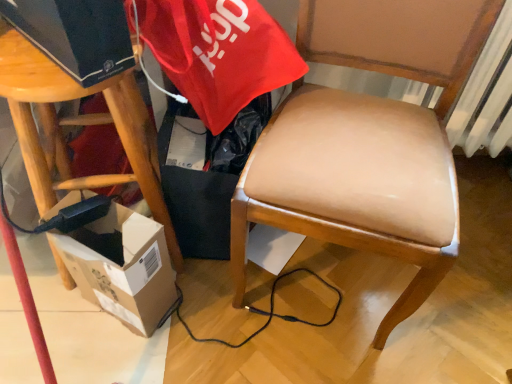
Question: Is wooden stool at left located outside cardboard box at lower left?

Choices:
 (A) yes
 (B) no

Answer: (A)

Question: Is the surface of wooden stool at left in direct contact with cardboard box at lower left?

Choices:
 (A) yes
 (B) no

Answer: (B)

Question: From the image's perspective, is wooden stool at left located above cardboard box at lower left?

Choices:
 (A) yes
 (B) no

Answer: (A)

Question: Considering the relative positions of wooden stool at left and cardboard box at lower left in the image provided, is wooden stool at left in front of cardboard box at lower left?

Choices:
 (A) yes
 (B) no

Answer: (A)

Question: Considering the relative sizes of wooden stool at left and cardboard box at lower left in the image provided, is wooden stool at left taller than cardboard box at lower left?

Choices:
 (A) no
 (B) yes

Answer: (B)

Question: Is leather-like tan chair at center in front of or behind cardboard box at lower left in the image?

Choices:
 (A) front
 (B) behind

Answer: (A)

Question: From a real-world perspective, is leather-like tan chair at center above or below cardboard box at lower left?

Choices:
 (A) above
 (B) below

Answer: (A)

Question: Based on their sizes in the image, would you say leather-like tan chair at center is bigger or smaller than cardboard box at lower left?

Choices:
 (A) big
 (B) small

Answer: (A)

Question: Visually, is leather-like tan chair at center positioned to the left or to the right of cardboard box at lower left?

Choices:
 (A) right
 (B) left

Answer: (A)

Question: Is leather-like tan chair at center wider or thinner than wooden stool at left?

Choices:
 (A) wide
 (B) thin

Answer: (A)

Question: Is leather-like tan chair at center taller or shorter than wooden stool at left?

Choices:
 (A) short
 (B) tall

Answer: (B)

Question: From the image's perspective, is leather-like tan chair at center positioned above or below wooden stool at left?

Choices:
 (A) above
 (B) below

Answer: (A)

Question: Relative to wooden stool at left, is leather-like tan chair at center in front or behind?

Choices:
 (A) front
 (B) behind

Answer: (A)

Question: Is wooden stool at left wider or thinner than cardboard box at lower left?

Choices:
 (A) wide
 (B) thin

Answer: (A)

Question: Relative to cardboard box at lower left, is wooden stool at left in front or behind?

Choices:
 (A) behind
 (B) front

Answer: (B)